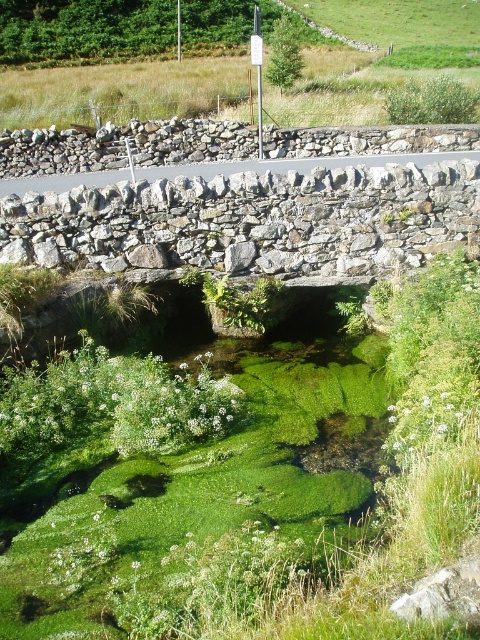
You are standing on the gray rough stone bridge at center and looking down at the gray rough stone at center below. Which object is closer to you?

The gray rough stone bridge at center is closer to you than the gray rough stone at center.

You are a hiker carrying a heavy backpack and need to cross the stream. The gray rough stone bridge at center is slippery due to algae. Can you safely step onto the gray rough stone at center from the bridge to avoid the algae?

The gray rough stone bridge at center and gray rough stone at center are 22.97 feet apart. Since the distance between them is too large, you cannot safely step from the bridge to the stone.